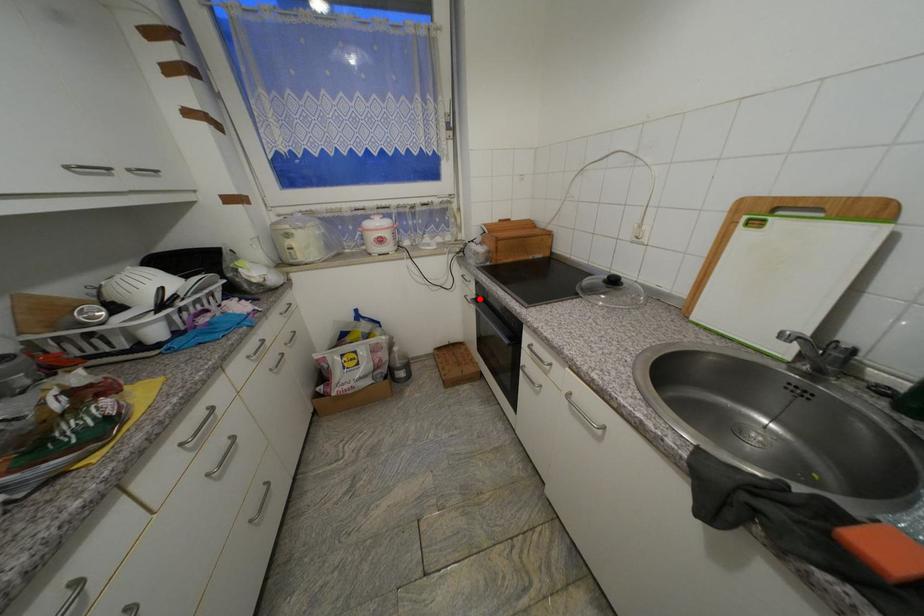
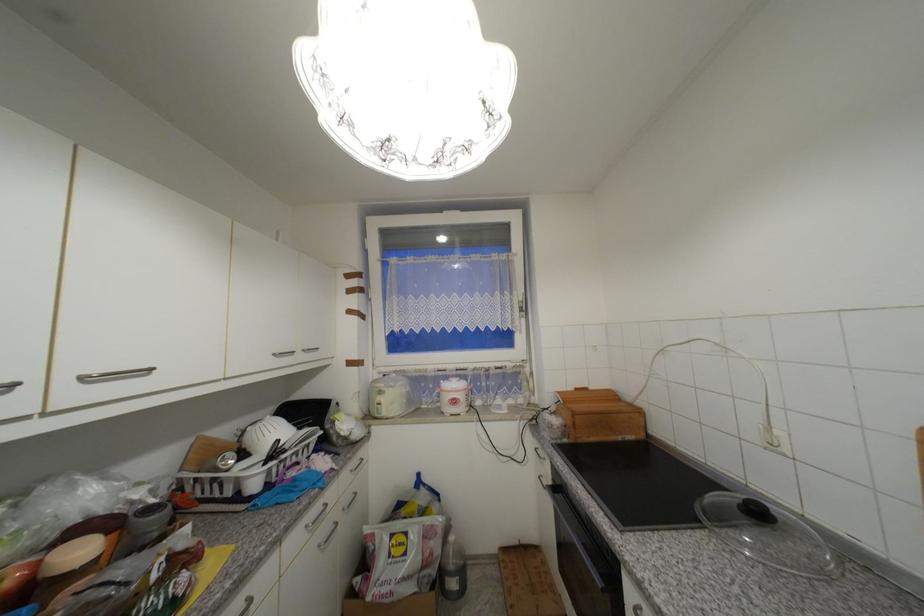
In the second image, find the point that corresponds to the highlighted location in the first image.

(555, 485)